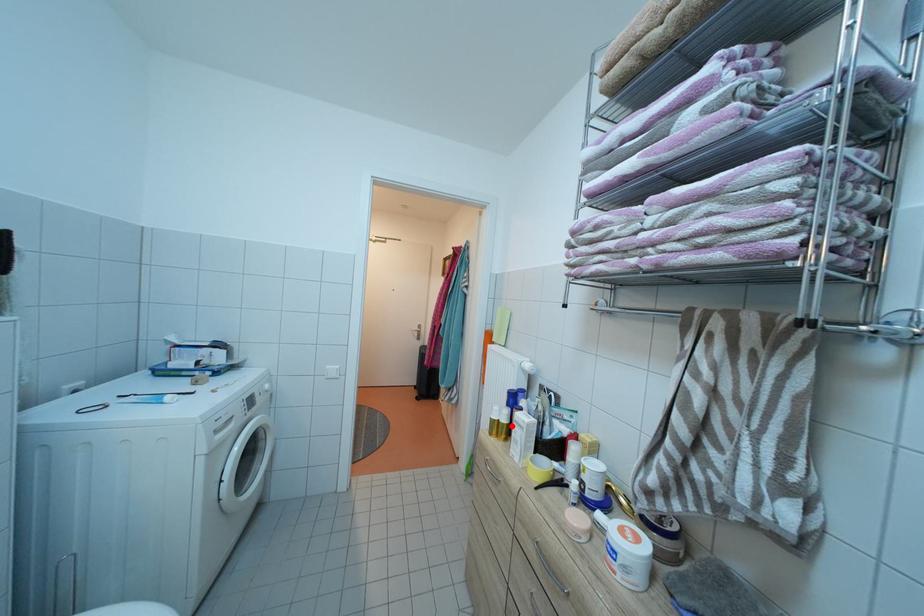
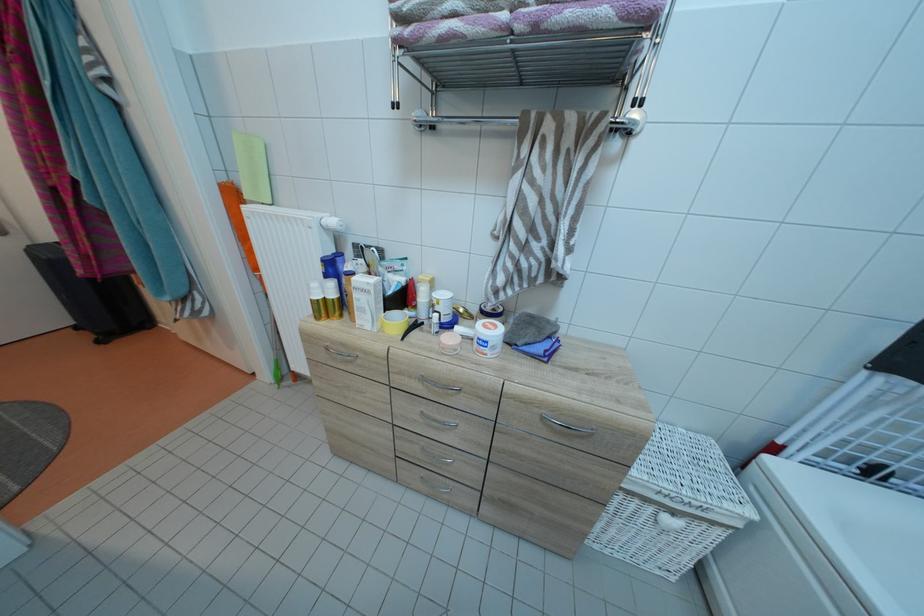
Locate, in the second image, the point that corresponds to the highlighted location in the first image.

(341, 301)